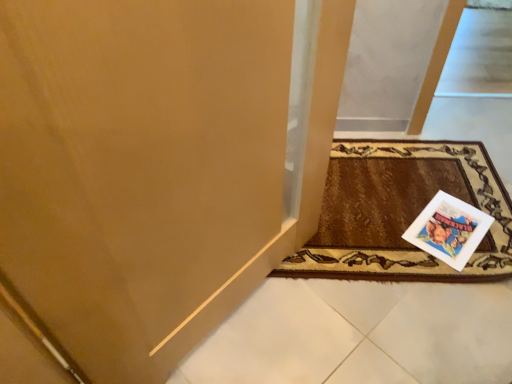
Question: Is white paper postcard at lower right taller or shorter than brown woven mat at lower right?

Choices:
 (A) short
 (B) tall

Answer: (A)

Question: Is point pyautogui.click(x=443, y=215) positioned closer to the camera than point pyautogui.click(x=274, y=273)?

Choices:
 (A) farther
 (B) closer

Answer: (A)

Question: Choose the correct answer: Is white paper postcard at lower right inside brown woven mat at lower right or outside it?

Choices:
 (A) outside
 (B) inside

Answer: (B)

Question: In the image, is brown woven mat at lower right positioned in front of or behind white paper postcard at lower right?

Choices:
 (A) behind
 (B) front

Answer: (B)

Question: Looking at the image, does brown woven mat at lower right seem bigger or smaller compared to white paper postcard at lower right?

Choices:
 (A) big
 (B) small

Answer: (A)

Question: From a real-world perspective, is brown woven mat at lower right physically located above or below white paper postcard at lower right?

Choices:
 (A) above
 (B) below

Answer: (A)

Question: Is brown woven mat at lower right taller or shorter than white paper postcard at lower right?

Choices:
 (A) short
 (B) tall

Answer: (B)